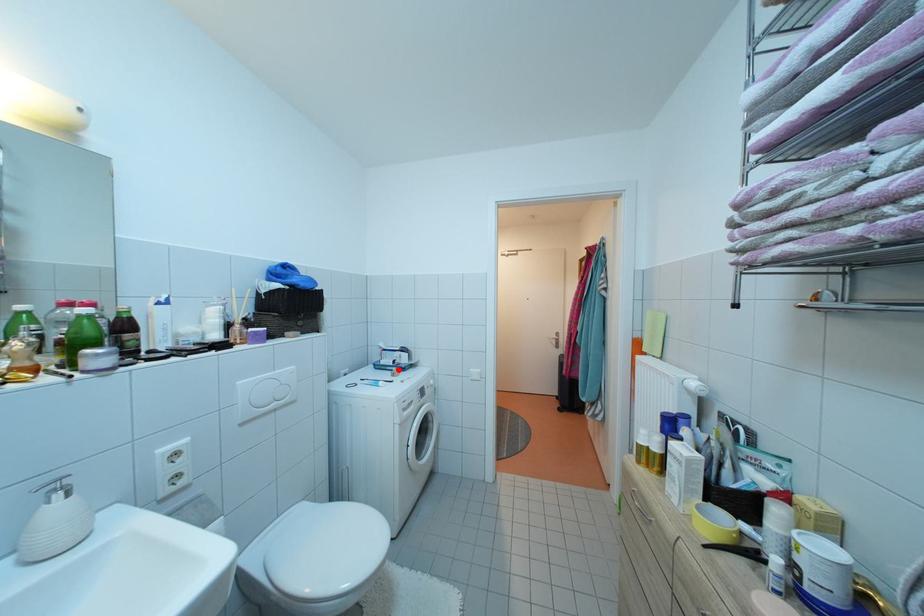
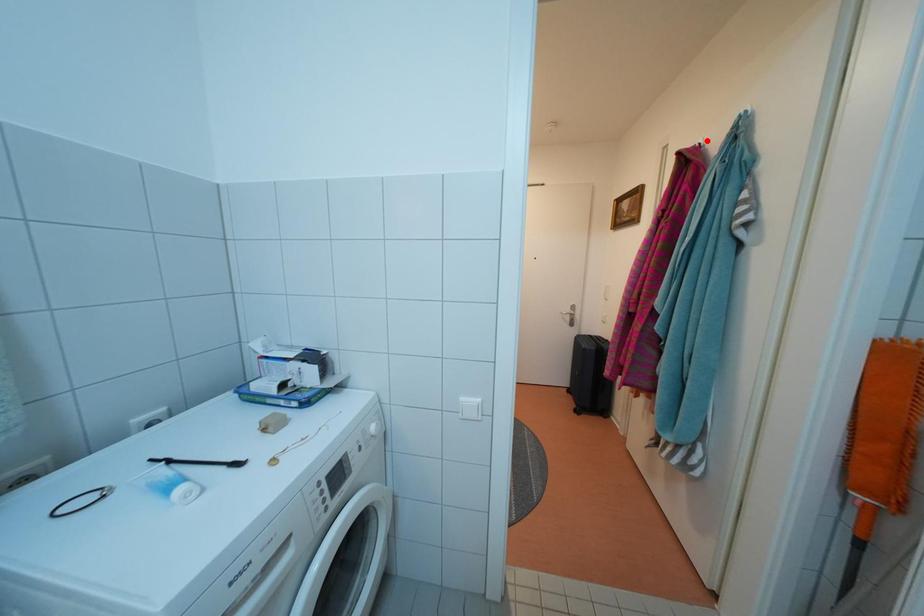
I am providing you with two images of the same scene from different viewpoints. A red point is marked on the first image and another point is marked on the second image. Are the points marked in image1 and image2 representing the same 3D position?

No